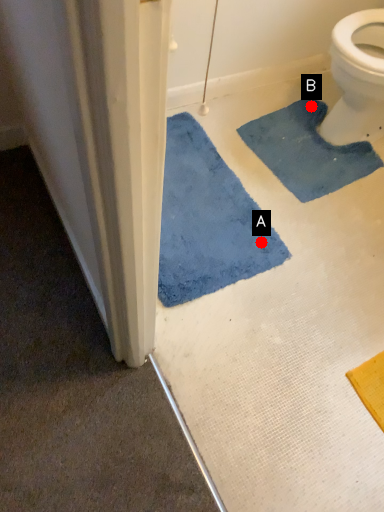
Question: Two points are circled on the image, labeled by A and B beside each circle. Which point is farther to the camera?

Choices:
 (A) A is further
 (B) B is further

Answer: (B)